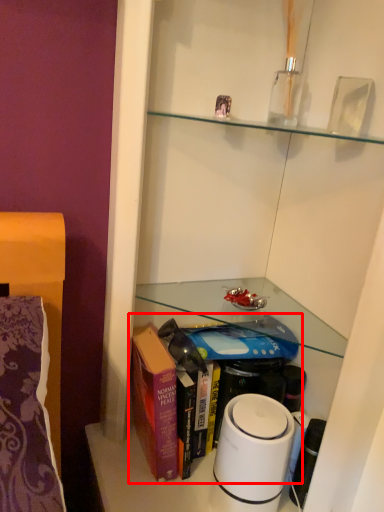
Question: From the image's perspective, where is book (annotated by the red box) located in relation to home appliance in the image?

Choices:
 (A) below
 (B) above

Answer: (B)